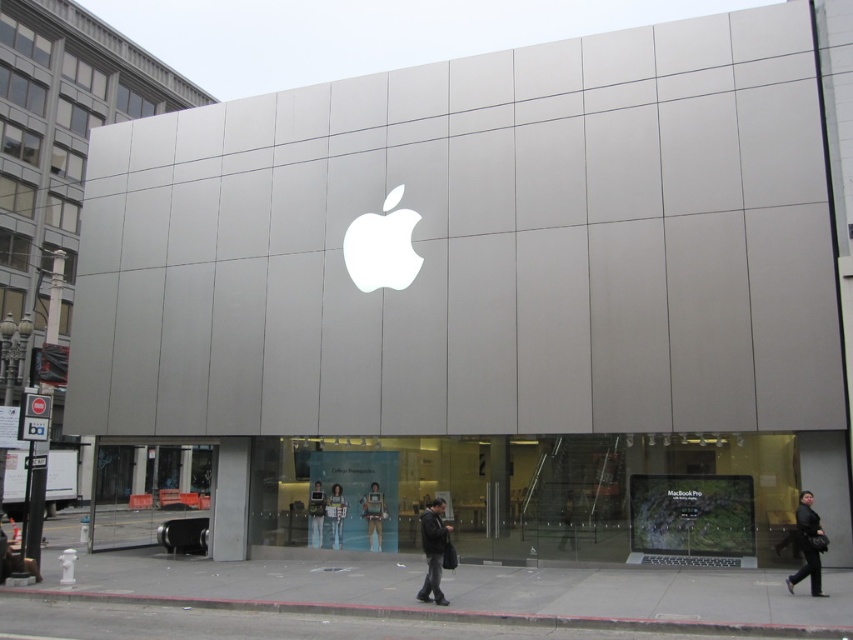
Question: Can you confirm if dark gray jacket at center is positioned to the right of light blue jeans at center?

Choices:
 (A) no
 (B) yes

Answer: (B)

Question: Which object is farther from the camera taking this photo?

Choices:
 (A) metallic silver suit at center
 (B) matte black suit at center
 (C) light blue jeans at center

Answer: (B)

Question: In this image, where is black leather jacket at lower right located relative to metallic silver suit at center?

Choices:
 (A) above
 (B) below

Answer: (A)

Question: Can you confirm if light blue jeans at center is positioned to the left of matte black suit at center?

Choices:
 (A) yes
 (B) no

Answer: (B)

Question: Which point appears farthest from the camera in this image?

Choices:
 (A) (335, 492)
 (B) (322, 522)
 (C) (793, 573)

Answer: (B)

Question: Which point is farther to the camera?

Choices:
 (A) light blue jeans at center
 (B) metallic silver suit at center
 (C) black leather jacket at lower right

Answer: (A)